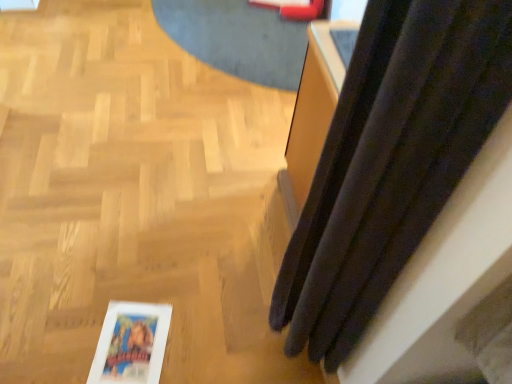
This screenshot has width=512, height=384. I want to click on vacant space to the right of white glossy magazine at lower left, so click(201, 342).